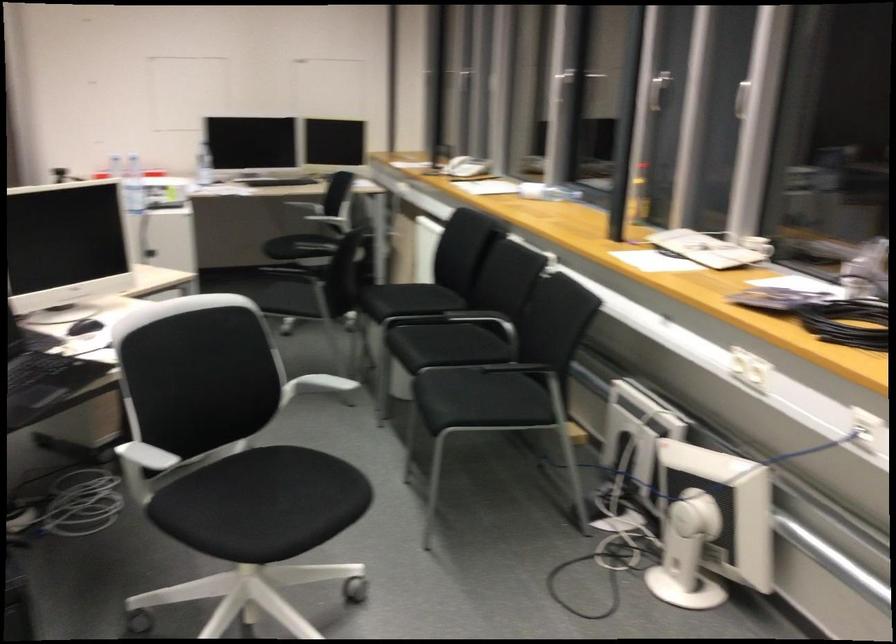
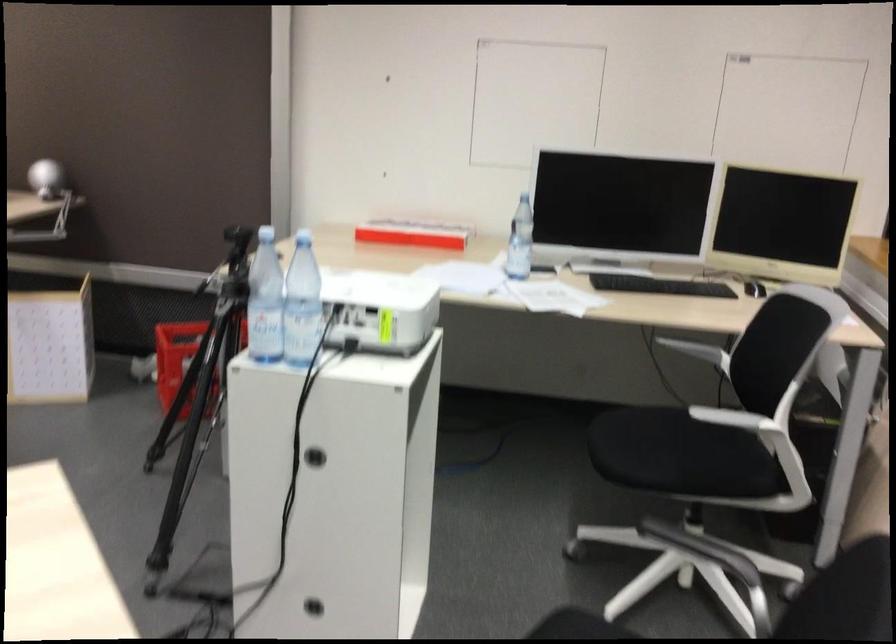
In the second image, find the point that corresponds to (165,185) in the first image.

(380, 308)